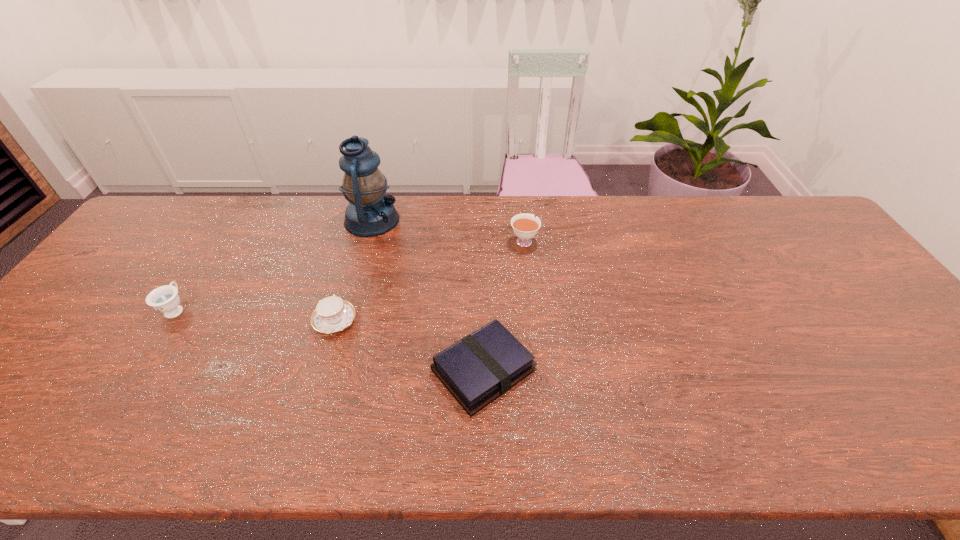
Find the location of a particular element. The height and width of the screenshot is (540, 960). vacant space at the near edge of the desktop is located at coordinates (408, 439).

Where is `free spot at the left edge of the desktop`? The image size is (960, 540). free spot at the left edge of the desktop is located at coordinates (17, 414).

This screenshot has height=540, width=960. In the image, there is a desktop. Find the location of `vacant space at the right edge`. vacant space at the right edge is located at coordinates (895, 343).

You are a GUI agent. You are given a task and a screenshot of the screen. Output one action in this format:
    pyautogui.click(x=<x>, y=<y>)
    Task: Click on the vacant space at the far right corner
    This screenshot has height=540, width=960.
    Given the screenshot: What is the action you would take?
    pyautogui.click(x=770, y=203)

The image size is (960, 540). I want to click on vacant point located between the farthest teacup and the lantern, so click(448, 231).

Image resolution: width=960 pixels, height=540 pixels. I want to click on vacant area between the tallest object and the rightmost teacup, so click(448, 231).

Locate an element on the screen. vacant space in between the farthest teacup and the leftmost object is located at coordinates (350, 275).

Locate an element on the screen. The image size is (960, 540). vacant space that's between the book and the tallest object is located at coordinates (428, 295).

You are a GUI agent. You are given a task and a screenshot of the screen. Output one action in this format:
    pyautogui.click(x=<x>, y=<y>)
    Task: Click on the vacant area that lies between the farthest teacup and the second teacup from right to left
    The width and height of the screenshot is (960, 540).
    Given the screenshot: What is the action you would take?
    pyautogui.click(x=429, y=281)

Find the location of `vacant space that is in between the book and the lantern`. vacant space that is in between the book and the lantern is located at coordinates (428, 295).